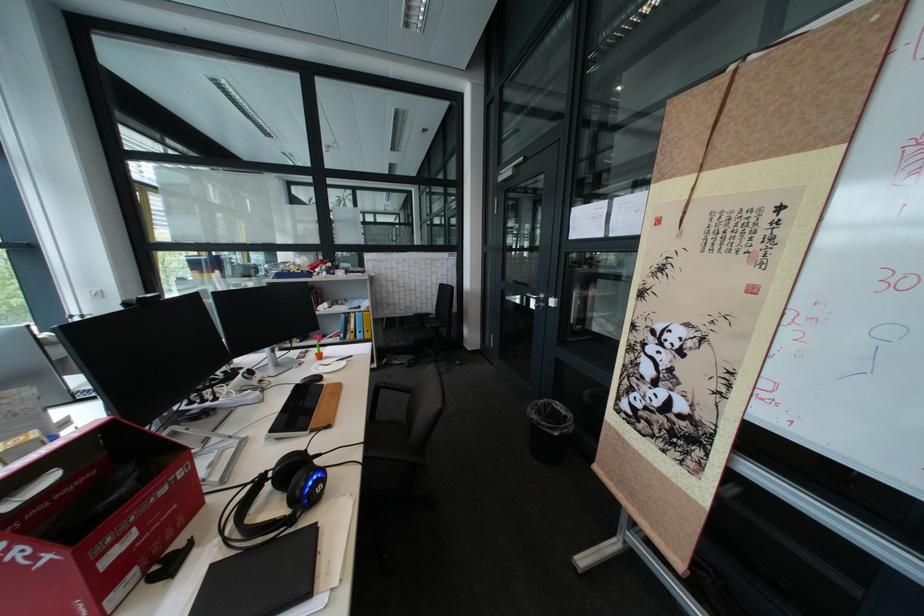
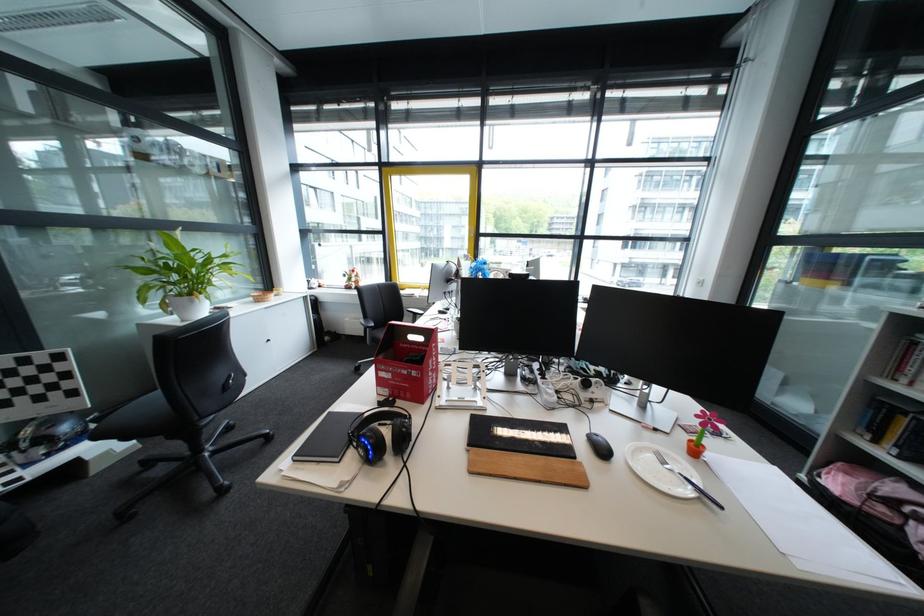
Where in the second image is the point corresponding to pixel 323 485 from the first image?

(378, 440)